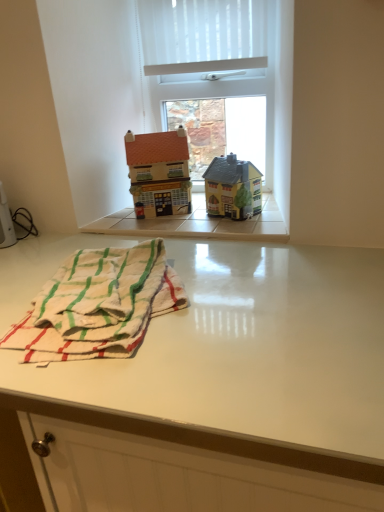
Question: Can you confirm if matte brown house at center, marked as the 2th toy in a right-to-left arrangement, is taller than white glossy table at lower center?

Choices:
 (A) yes
 (B) no

Answer: (B)

Question: From a real-world perspective, is matte brown house at center, placed as the 1th toy when sorted from left to right, physically above white glossy table at lower center?

Choices:
 (A) yes
 (B) no

Answer: (A)

Question: Is the position of matte brown house at center, placed as the 1th toy when sorted from left to right, more distant than that of white glossy table at lower center?

Choices:
 (A) no
 (B) yes

Answer: (B)

Question: From the image's perspective, is matte brown house at center, placed as the 1th toy when sorted from left to right, beneath white glossy table at lower center?

Choices:
 (A) yes
 (B) no

Answer: (B)

Question: Could white glossy table at lower center be considered to be inside matte brown house at center, placed as the 1th toy when sorted from left to right?

Choices:
 (A) no
 (B) yes

Answer: (A)

Question: Is matte brown house at center, placed as the 1th toy when sorted from left to right, oriented towards white glossy table at lower center?

Choices:
 (A) yes
 (B) no

Answer: (B)

Question: Is matte brown house at center, placed as the 1th toy when sorted from left to right, to the left of white woven beach towel at lower left from the viewer's perspective?

Choices:
 (A) yes
 (B) no

Answer: (B)

Question: Does matte brown house at center, placed as the 1th toy when sorted from left to right, have a greater width compared to white woven beach towel at lower left?

Choices:
 (A) no
 (B) yes

Answer: (A)

Question: From the image's perspective, is matte brown house at center, marked as the 2th toy in a right-to-left arrangement, above white woven beach towel at lower left?

Choices:
 (A) yes
 (B) no

Answer: (A)

Question: Can you confirm if matte brown house at center, placed as the 1th toy when sorted from left to right, is taller than white woven beach towel at lower left?

Choices:
 (A) no
 (B) yes

Answer: (B)

Question: Is matte brown house at center, marked as the 2th toy in a right-to-left arrangement, further to the viewer compared to white woven beach towel at lower left?

Choices:
 (A) yes
 (B) no

Answer: (A)

Question: Considering the relative sizes of matte brown house at center, placed as the 1th toy when sorted from left to right, and white woven beach towel at lower left in the image provided, is matte brown house at center, placed as the 1th toy when sorted from left to right, shorter than white woven beach towel at lower left?

Choices:
 (A) no
 (B) yes

Answer: (A)

Question: Can you confirm if white woven beach towel at lower left is positioned to the right of matte brown house at center, marked as the 2th toy in a right-to-left arrangement?

Choices:
 (A) yes
 (B) no

Answer: (B)